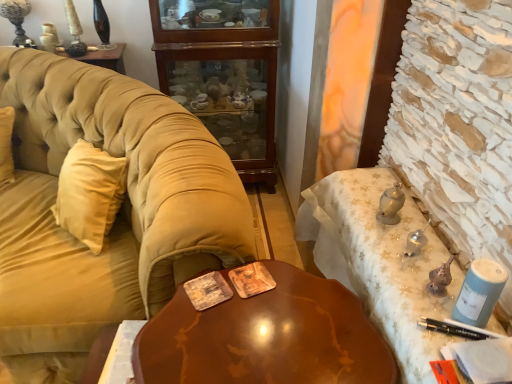
Locate an element on the screen. The width and height of the screenshot is (512, 384). blank space situated above metallic silver desk at right (from a real-world perspective) is located at coordinates (407, 245).